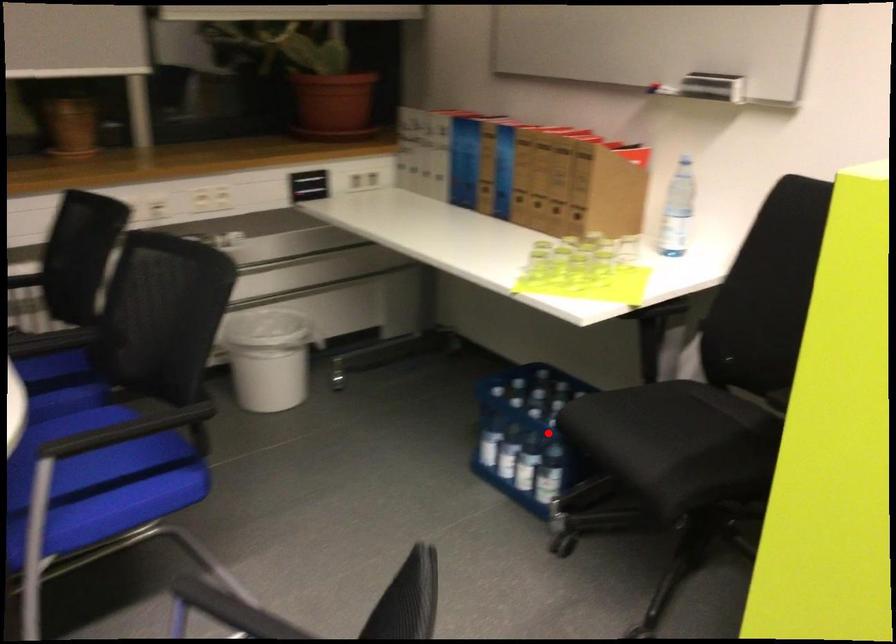
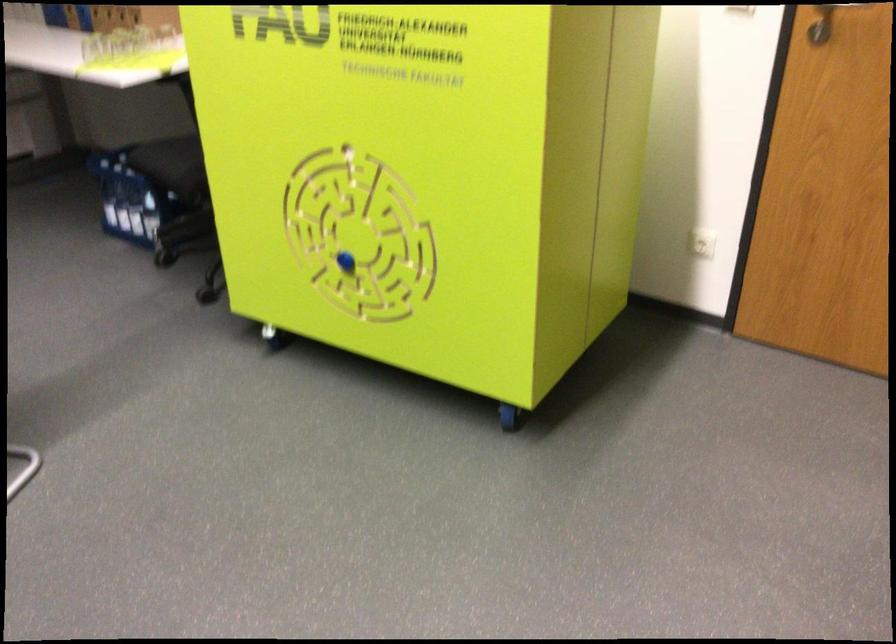
Where in the second image is the point corresponding to the highlighted location from the first image?

(149, 185)